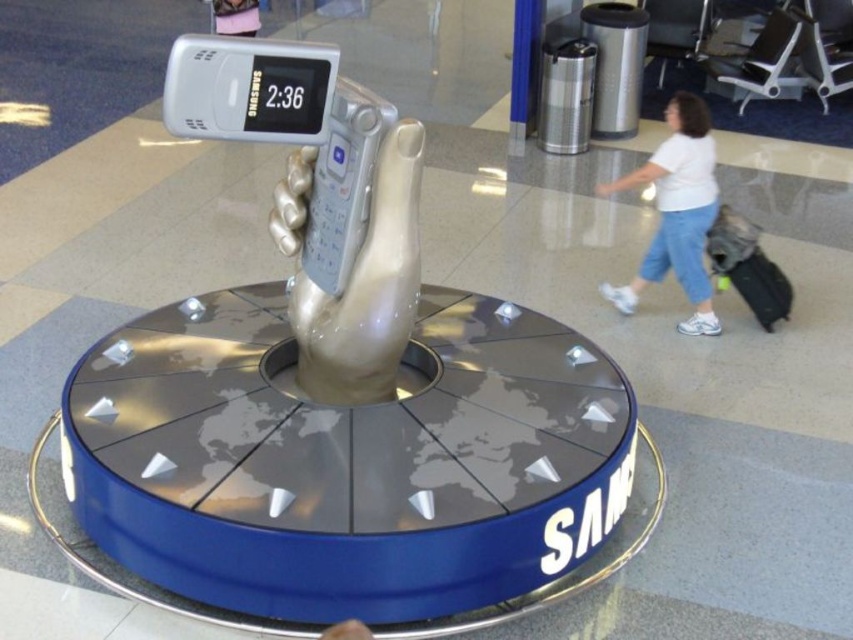
You are an airport employee who needs to clean the Samsung advertisement display. You have two points to clean on the metallic sculpture of the hand holding the phone. The points are labeled as point (654, 236) and point (722, 262). Which point should you clean first if you want to start with the one closer to you?

Point (654, 236) is closer to you than point (722, 262), so you should clean point (654, 236) first.

You are a photographer at the airport terminal and need to capture a photo of the Samsung advertisement. The scene includes a white cotton shirt at upper right. Where should you position yourself to ensure the shirt is in the frame while focusing on the Samsung advertisement centerpiece?

The white cotton shirt at upper right is located at point [676,212], so you should position yourself to the upper right side of the scene to include the shirt in the frame while keeping the Samsung advertisement centerpiece in focus.

You are a traveler who just arrived at the airport and see the Samsung advertisement. You want to place your black fabric suitcase at right on top of the white cotton shirt at upper right. Is the shirt tall enough to support the suitcase?

The white cotton shirt at upper right is much taller than the black fabric suitcase at right, so yes, the shirt is tall enough to support the suitcase.